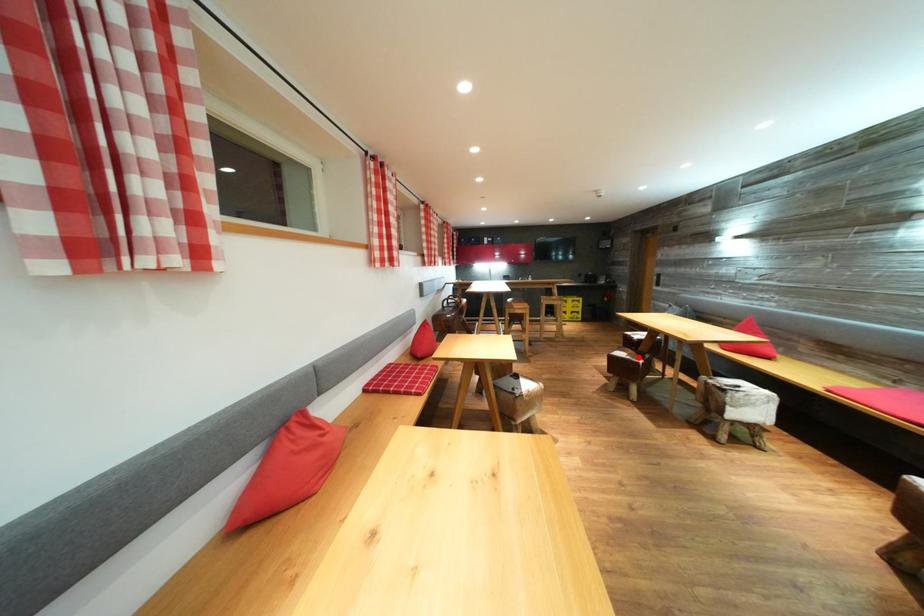
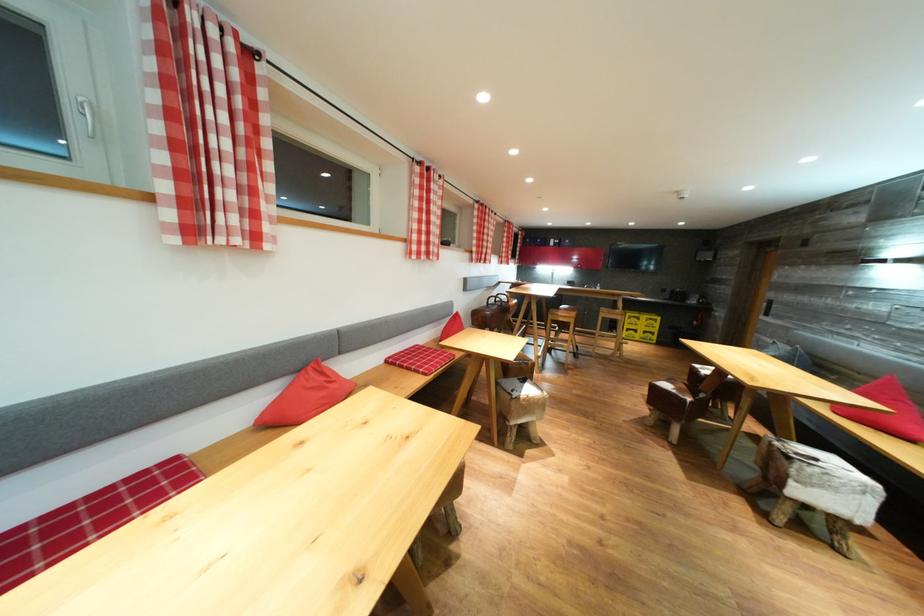
Where in the second image is the point corresponding to the highlighted location from the first image?

(689, 392)